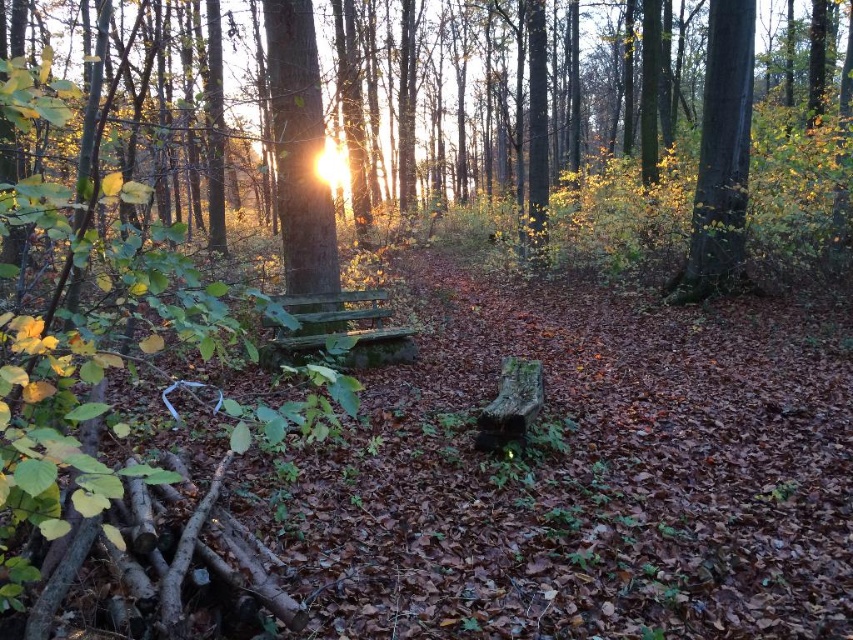
This screenshot has width=853, height=640. Describe the element at coordinates (299, 154) in the screenshot. I see `smooth brown tree trunk at center` at that location.

Is smooth brown tree trunk at center positioned at the back of green mossy bench at center?

Yes, smooth brown tree trunk at center is further from the viewer.

This screenshot has width=853, height=640. Find the location of `smooth brown tree trunk at center`. smooth brown tree trunk at center is located at coordinates (299, 154).

Does brown wood bench at center lie behind smooth bark tree at upper right?

No.

Is point (502, 195) less distant than point (734, 236)?

That is False.

Find the location of a particular element. The height and width of the screenshot is (640, 853). brown wood bench at center is located at coordinates (585, 152).

The image size is (853, 640). I want to click on brown wood bench at center, so click(x=585, y=152).

How distant is smooth bark tree at upper right from green mossy bench at center?

They are 4.19 meters apart.

Based on the photo, is smooth bark tree at upper right closer to camera compared to green mossy bench at center?

No, it is behind green mossy bench at center.

Locate an element on the screen. This screenshot has width=853, height=640. smooth bark tree at upper right is located at coordinates (720, 156).

Find the location of a particular element. The width and height of the screenshot is (853, 640). smooth bark tree at upper right is located at coordinates (720, 156).